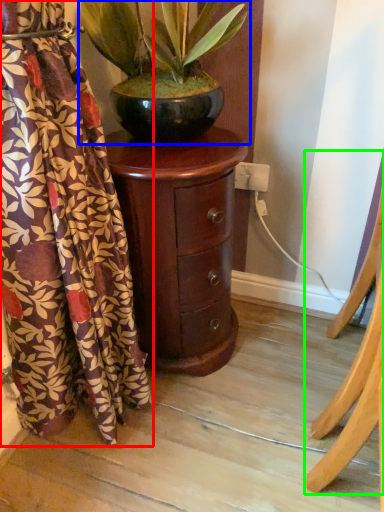
Question: Which is nearer to the curtain (highlighted by a red box)? houseplant (highlighted by a blue box) or furniture (highlighted by a green box).

Choices:
 (A) houseplant
 (B) furniture

Answer: (A)